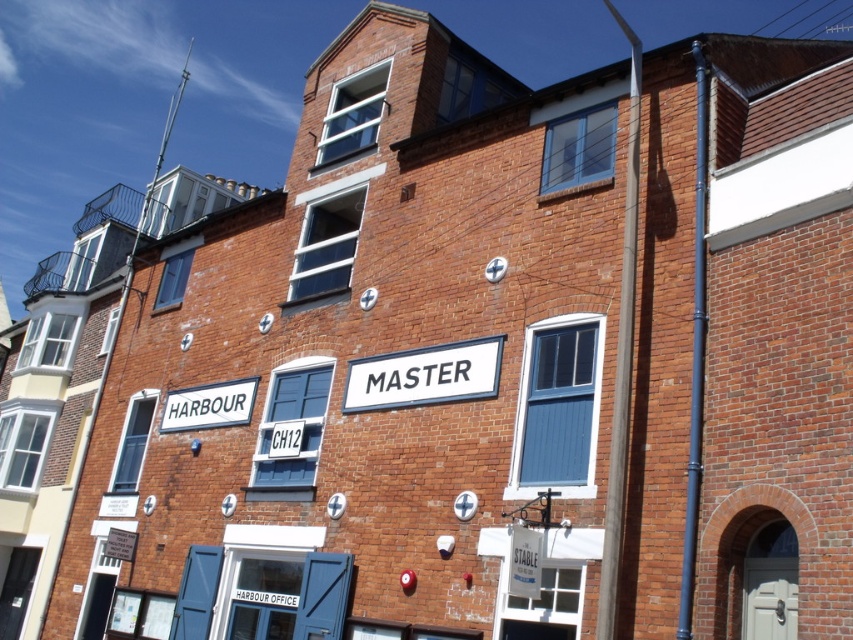
Question: Is white plastic sign at center behind white painted wood sign at lower left?

Choices:
 (A) yes
 (B) no

Answer: (B)

Question: From the image, what is the correct spatial relationship of white plastic sign at center in relation to white painted wood sign at lower left?

Choices:
 (A) below
 (B) above

Answer: (B)

Question: Is white plastic sign at center behind white painted wood sign at lower left?

Choices:
 (A) no
 (B) yes

Answer: (A)

Question: Which object is closer to the camera taking this photo?

Choices:
 (A) white plastic sign at center
 (B) white painted wood sign at lower left

Answer: (A)